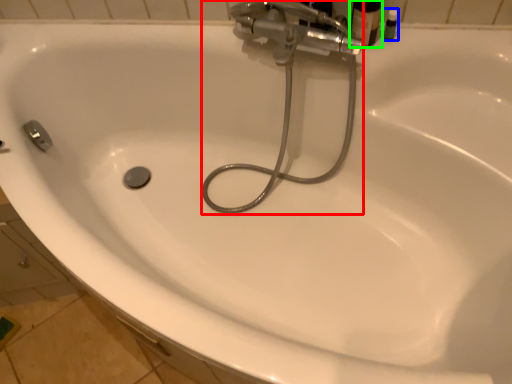
Question: Which object is positioned farthest from plumbing fixture (highlighted by a red box)? Select from toiletry (highlighted by a blue box) and toiletry (highlighted by a green box).

Choices:
 (A) toiletry
 (B) toiletry

Answer: (A)